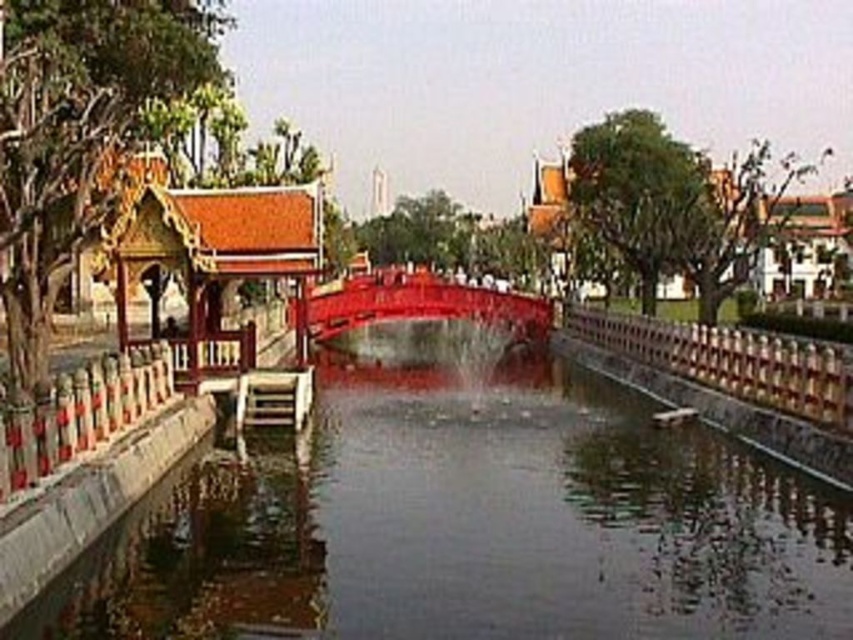
Can you confirm if smooth concrete river at center is wider than glossy wood bridge at center?

No, smooth concrete river at center is not wider than glossy wood bridge at center.

Can you confirm if smooth concrete river at center is thinner than glossy wood bridge at center?

Correct, smooth concrete river at center's width is less than glossy wood bridge at center's.

Locate an element on the screen. The width and height of the screenshot is (853, 640). smooth concrete river at center is located at coordinates (463, 516).

This screenshot has width=853, height=640. I want to click on smooth concrete river at center, so click(x=463, y=516).